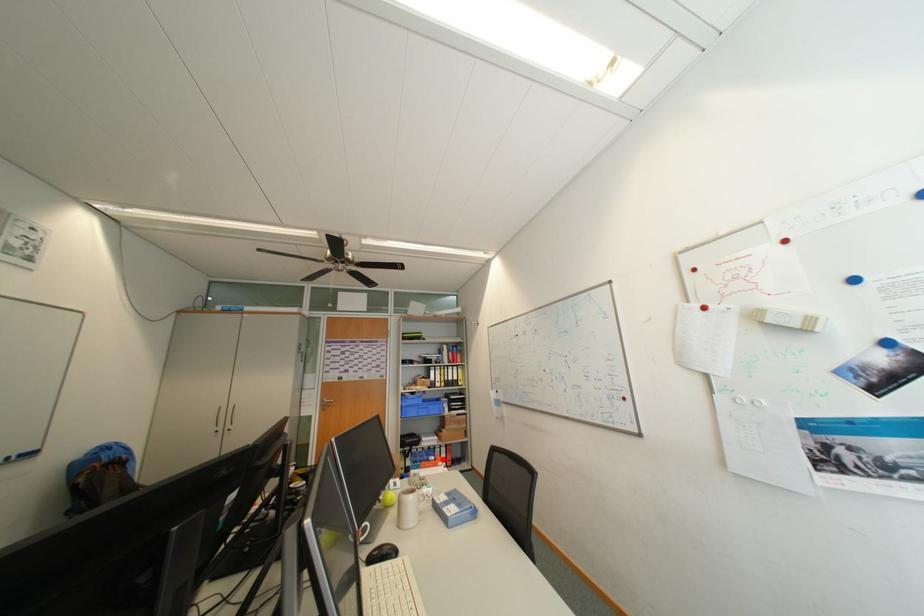
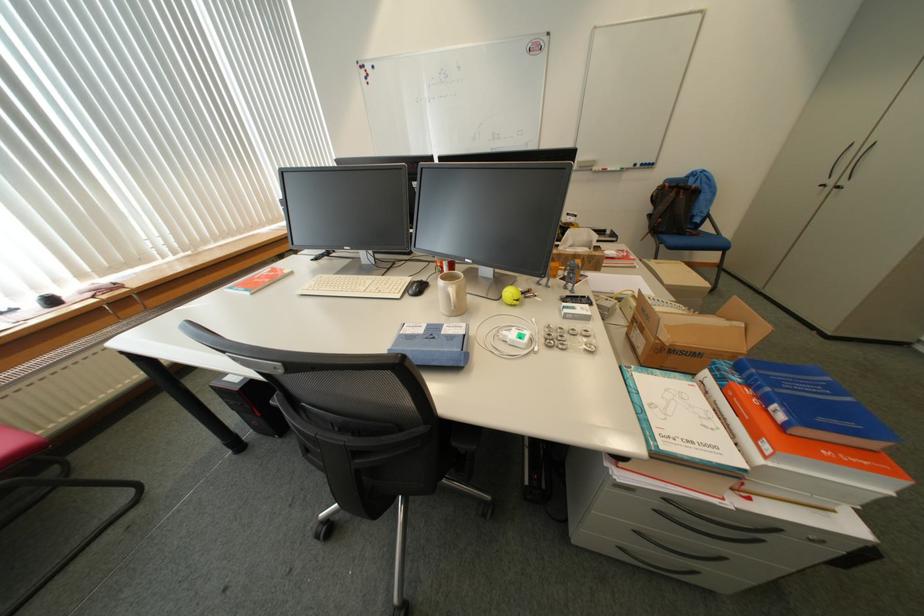
Question: I am providing you with two images of the same scene from different viewpoints. A red point is marked on the first image. At the location where the point appears in image 1, is it still visible in image 2?

Choices:
 (A) Yes
 (B) No

Answer: (A)